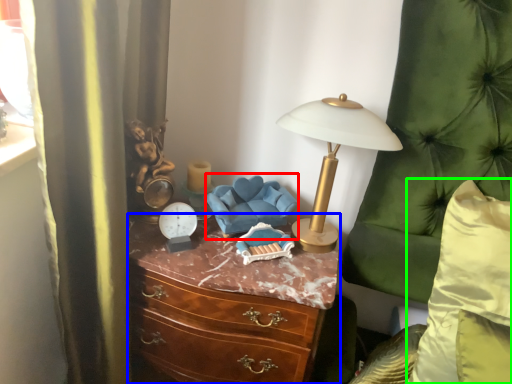
Question: Which object is the closest to the swivel chair (highlighted by a red box)? Choose among these: chest of drawers (highlighted by a blue box) or pillow (highlighted by a green box).

Choices:
 (A) chest of drawers
 (B) pillow

Answer: (A)